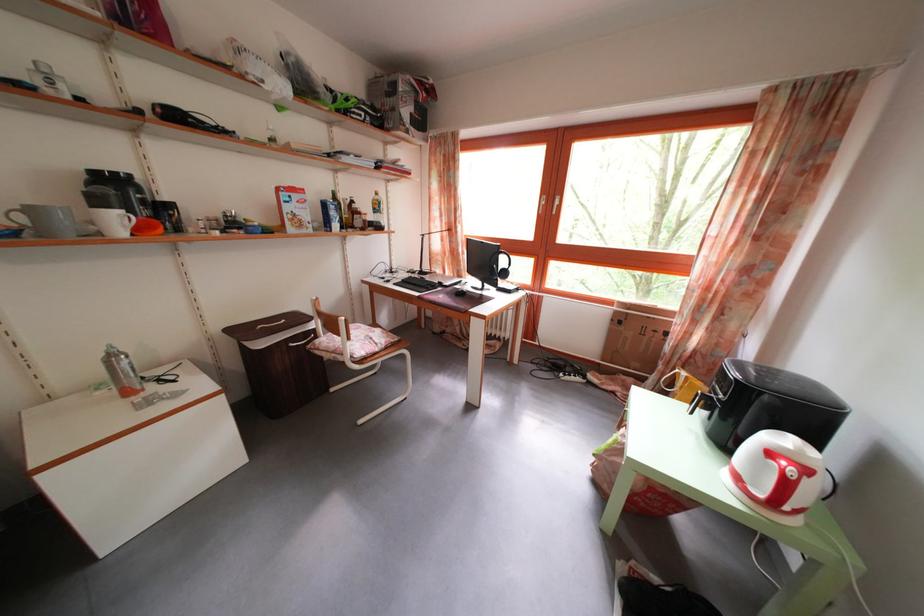
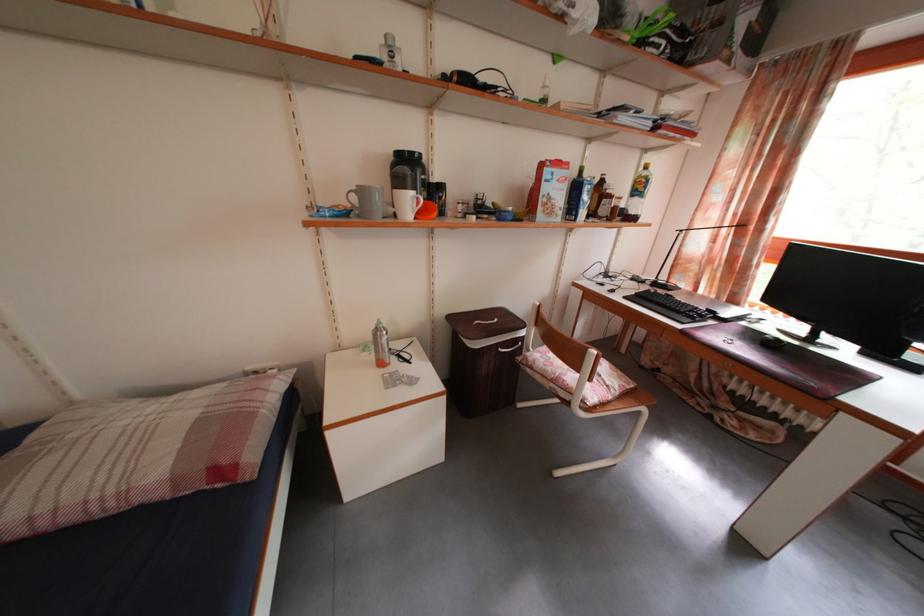
Where in the second image is the point corresponding to (x=433, y=275) from the first image?

(671, 285)